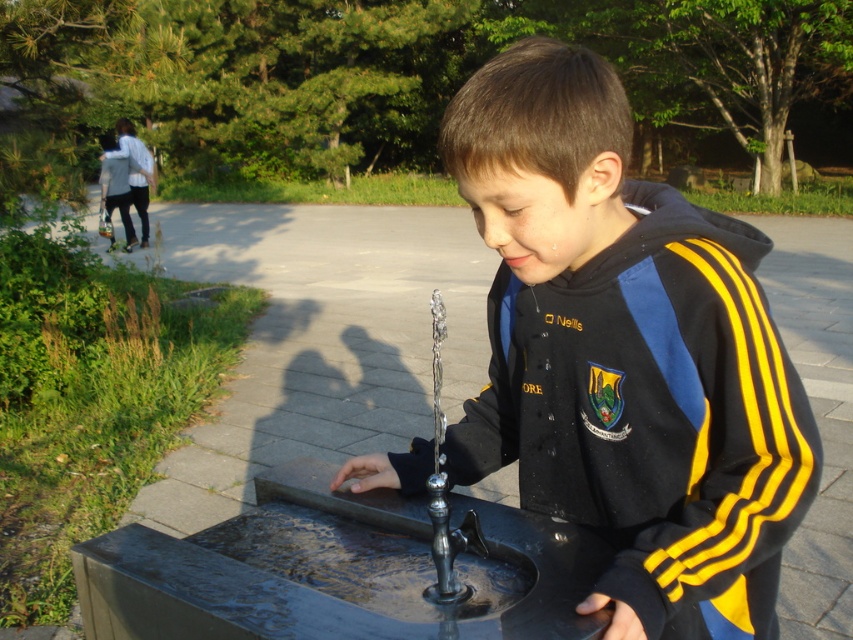
You are standing at the point marked by coordinates (625, 355) in the park scene. What object is located exactly at this point?

The point marked by coordinates (625, 355) is located at the black yellow track jacket at center.